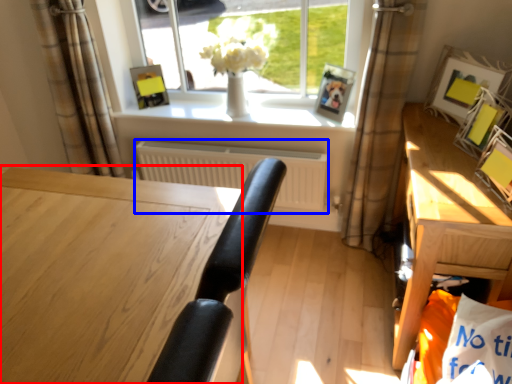
Question: Which object appears closest to the camera in this image, desk (highlighted by a red box) or radiator (highlighted by a blue box)?

Choices:
 (A) desk
 (B) radiator

Answer: (A)